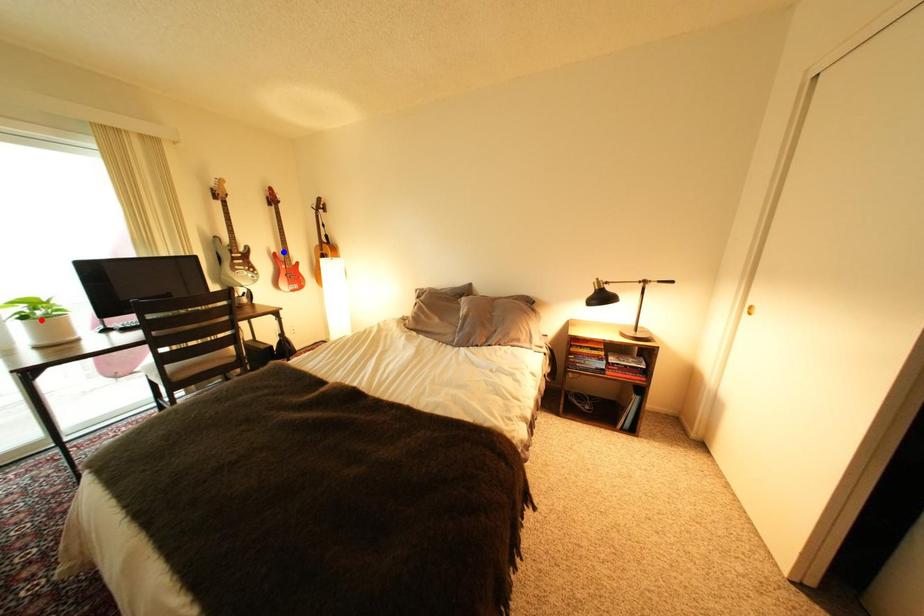
Question: Two points are marked on the image. Which point is closer to the camera?

Choices:
 (A) Blue point is closer.
 (B) Red point is closer.

Answer: (B)